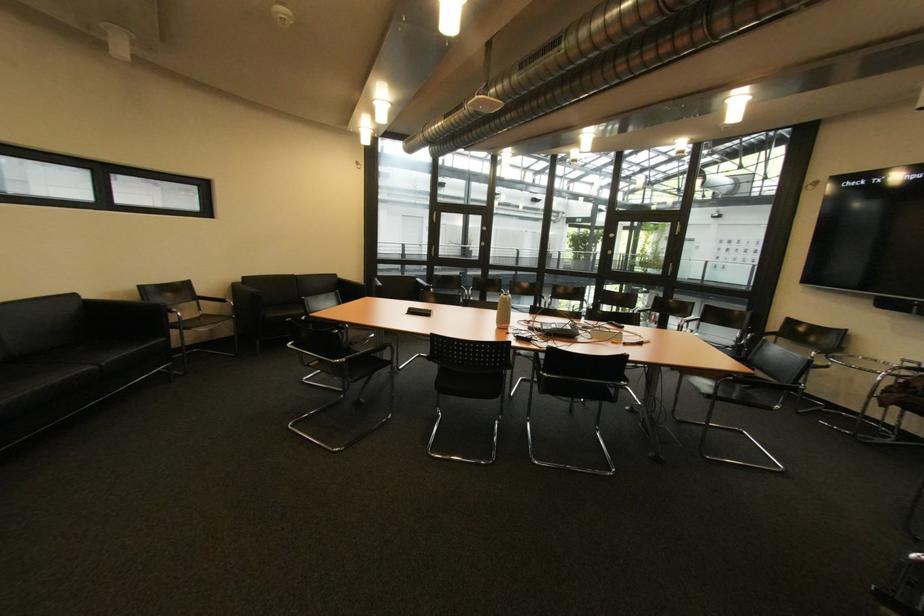
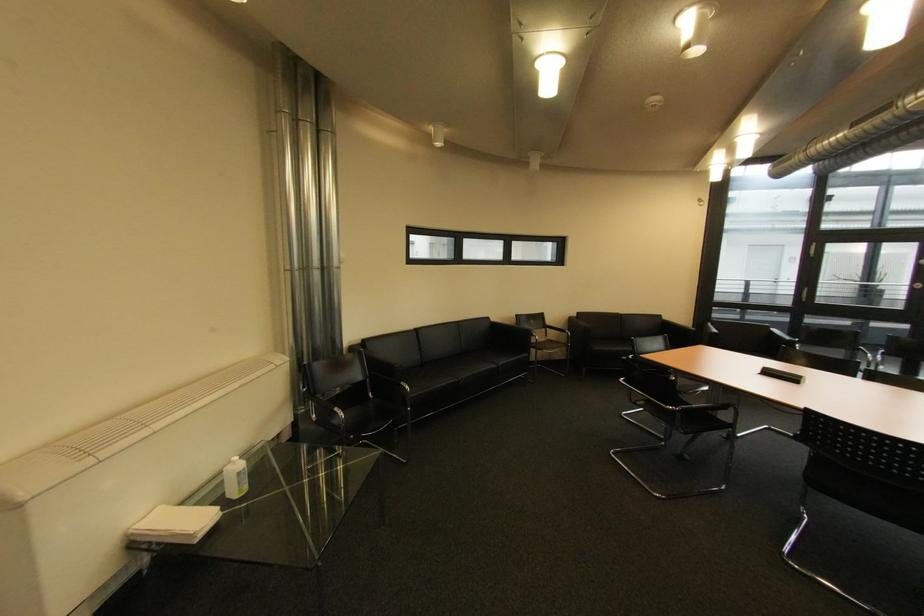
In the second image, find the point that corresponds to (383,283) in the first image.

(716, 329)